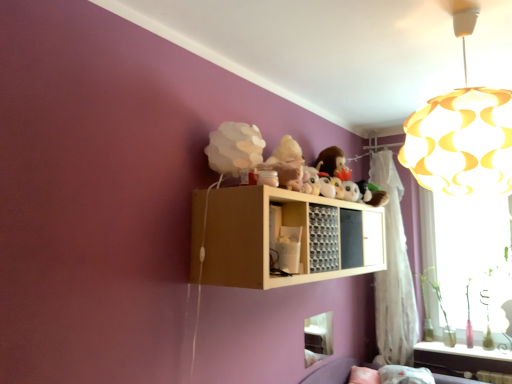
Where is `wooden grid at upper center`? wooden grid at upper center is located at coordinates (323, 238).

Describe the element at coordinates (234, 148) in the screenshot. I see `white matte cloud at upper center` at that location.

The image size is (512, 384). What do you see at coordinates (461, 351) in the screenshot?
I see `translucent glass bottles at lower right` at bounding box center [461, 351].

Measure the distance between point (496,232) and camera.

The depth of point (496,232) is 2.94 meters.

Find the location of a particular element. The width and height of the screenshot is (512, 384). wooden grid at upper center is located at coordinates (323, 238).

From a real-world perspective, is yellow paper lampshade at upper right positioned above or below translucent glass bottles at lower right?

yellow paper lampshade at upper right is above translucent glass bottles at lower right.

Does yellow paper lampshade at upper right have a greater width compared to translucent glass bottles at lower right?

Yes, yellow paper lampshade at upper right is wider than translucent glass bottles at lower right.

Who is more distant, yellow paper lampshade at upper right or translucent glass bottles at lower right?

Positioned behind is translucent glass bottles at lower right.

Is yellow paper lampshade at upper right not near translucent glass bottles at lower right?

yellow paper lampshade at upper right is positioned a significant distance from translucent glass bottles at lower right.

From the picture: Can white sheer curtain at right be found inside translucent glass bottles at lower right?

That's incorrect, white sheer curtain at right is not inside translucent glass bottles at lower right.

From the picture: From a real-world perspective, is translucent glass bottles at lower right positioned over white sheer curtain at right based on gravity?

Incorrect, from a real-world perspective, translucent glass bottles at lower right is lower than white sheer curtain at right.

Considering the sizes of objects translucent glass bottles at lower right and white sheer curtain at right in the image provided, who is taller, translucent glass bottles at lower right or white sheer curtain at right?

white sheer curtain at right.

Which is more to the right, translucent glass bottles at lower right or white sheer curtain at right?

translucent glass bottles at lower right.

Which object is positioned more to the right, transparent glass window at right, placed as the second window screen when sorted from left to right, or fuzzy fabric plush at upper center?

From the viewer's perspective, transparent glass window at right, placed as the second window screen when sorted from left to right, appears more on the right side.

What's the angular difference between transparent glass window at right, placed as the second window screen when sorted from left to right, and fuzzy fabric plush at upper center's facing directions?

The facing directions of transparent glass window at right, placed as the second window screen when sorted from left to right, and fuzzy fabric plush at upper center are 92.2 degrees apart.

From the picture: Is transparent glass window at right, the 1th window screen viewed from the back, oriented towards fuzzy fabric plush at upper center?

Yes, transparent glass window at right, the 1th window screen viewed from the back, faces towards fuzzy fabric plush at upper center.

From a real-world perspective, is transparent glass window at right, placed as the second window screen when sorted from left to right, under fuzzy fabric plush at upper center?

Yes, from a real-world perspective, transparent glass window at right, placed as the second window screen when sorted from left to right, is below fuzzy fabric plush at upper center.

In the scene shown: Between wooden grid at upper center and yellow paper lampshade at upper right, which one has less height?

wooden grid at upper center is shorter.

How many degrees apart are the facing directions of wooden grid at upper center and yellow paper lampshade at upper right?

There is a 89.4-degree angle between the facing directions of wooden grid at upper center and yellow paper lampshade at upper right.

From the image's perspective, relative to yellow paper lampshade at upper right, is wooden grid at upper center above or below?

wooden grid at upper center is situated lower than yellow paper lampshade at upper right in the image.

Considering the sizes of objects wooden grid at upper center and yellow paper lampshade at upper right in the image provided, who is smaller, wooden grid at upper center or yellow paper lampshade at upper right?

wooden grid at upper center is smaller.

Which of these two, white sheer curtain at right or fuzzy fabric plush at upper center, is wider?

fuzzy fabric plush at upper center is wider.

Can you tell me how much white sheer curtain at right and fuzzy fabric plush at upper center differ in facing direction?

They differ by 91.3 degrees in their facing directions.

From the image's perspective, does white sheer curtain at right appear lower than fuzzy fabric plush at upper center?

Yes, from the image's perspective, white sheer curtain at right is below fuzzy fabric plush at upper center.

From the image's perspective, is transparent glass window at right, which is counted as the 2th window screen, starting from the front, located above or below translucent glass bottles at lower right?

Based on their image positions, transparent glass window at right, which is counted as the 2th window screen, starting from the front, is located above translucent glass bottles at lower right.

From a real-world perspective, which object rests below the other?

translucent glass bottles at lower right.

Between transparent glass window at right, which is counted as the 2th window screen, starting from the front, and translucent glass bottles at lower right, which one has smaller width?

With smaller width is transparent glass window at right, which is counted as the 2th window screen, starting from the front.

Would you say transparent glass window at right, which is counted as the 2th window screen, starting from the front, is outside translucent glass bottles at lower right?

That's correct, transparent glass window at right, which is counted as the 2th window screen, starting from the front, is outside of translucent glass bottles at lower right.

Can we say fuzzy fabric plush at upper center lies outside white matte cloud at upper center?

That's correct, fuzzy fabric plush at upper center is outside of white matte cloud at upper center.

Which object is thinner, fuzzy fabric plush at upper center or white matte cloud at upper center?

fuzzy fabric plush at upper center.

Is fuzzy fabric plush at upper center positioned far away from white matte cloud at upper center?

No, fuzzy fabric plush at upper center is in close proximity to white matte cloud at upper center.

Is fuzzy fabric plush at upper center oriented away from white matte cloud at upper center?

No, fuzzy fabric plush at upper center's orientation is not away from white matte cloud at upper center.

Identify the location of lamp above the translucent glass bottles at lower right (from the image's perspective). (462, 131).

I want to click on window sill below the white sheer curtain at right (from the image's perspective), so click(461, 351).

When comparing their distances from transparent glass window at right, the 1th window screen viewed from the back, does transparent plastic window screen at lower center, which appears as the 2th window screen when viewed from the right, or fuzzy fabric plush at upper center seem further?

fuzzy fabric plush at upper center lies further to transparent glass window at right, the 1th window screen viewed from the back, than the other object.

Which object lies further to the anchor point white sheer curtain at right, fuzzy fabric plush at upper center or translucent glass bottles at lower right?

fuzzy fabric plush at upper center is positioned further to the anchor white sheer curtain at right.

Considering their positions, is white sheer curtain at right positioned further to white matte cloud at upper center than yellow paper lampshade at upper right?

Based on the image, white sheer curtain at right appears to be further to white matte cloud at upper center.

When comparing their distances from yellow paper lampshade at upper right, does transparent glass window at right, the 1th window screen viewed from the back, or fuzzy fabric plush at upper center seem closer?

fuzzy fabric plush at upper center is closer to yellow paper lampshade at upper right.

When comparing their distances from yellow paper lampshade at upper right, does transparent plastic window screen at lower center, positioned as the first window screen in front-to-back order, or wooden grid at upper center seem closer?

wooden grid at upper center lies closer to yellow paper lampshade at upper right than the other object.

Which object lies nearer to the anchor point light wood shelf at upper center, white sheer curtain at right or fuzzy fabric plush at upper center?

fuzzy fabric plush at upper center lies closer to light wood shelf at upper center than the other object.

When comparing their distances from transparent glass window at right, placed as the 1th window screen when sorted from right to left, does translucent glass bottles at lower right or white sheer curtain at right seem closer?

white sheer curtain at right lies closer to transparent glass window at right, placed as the 1th window screen when sorted from right to left, than the other object.

When comparing their distances from transparent glass window at right, placed as the 1th window screen when sorted from right to left, does transparent plastic window screen at lower center, positioned as the first window screen in front-to-back order, or light wood shelf at upper center seem closer?

The object closer to transparent glass window at right, placed as the 1th window screen when sorted from right to left, is transparent plastic window screen at lower center, positioned as the first window screen in front-to-back order.

Find the location of a particular element. The height and width of the screenshot is (384, 512). cabinet between white matte cloud at upper center and white sheer curtain at right in the front-back direction is located at coordinates (323, 238).

What are the coordinates of `cabinet located between yellow paper lampshade at upper right and fuzzy fabric plush at upper center in the depth direction` in the screenshot? It's located at (323, 238).

Where is `figurine situated between white matte cloud at upper center and translucent glass bottles at lower right from left to right`? The image size is (512, 384). figurine situated between white matte cloud at upper center and translucent glass bottles at lower right from left to right is located at coordinates (287, 164).

Find the location of a particular element. toy between yellow paper lampshade at upper right and transparent glass window at right, placed as the second window screen when sorted from left to right, from front to back is located at coordinates (234, 148).